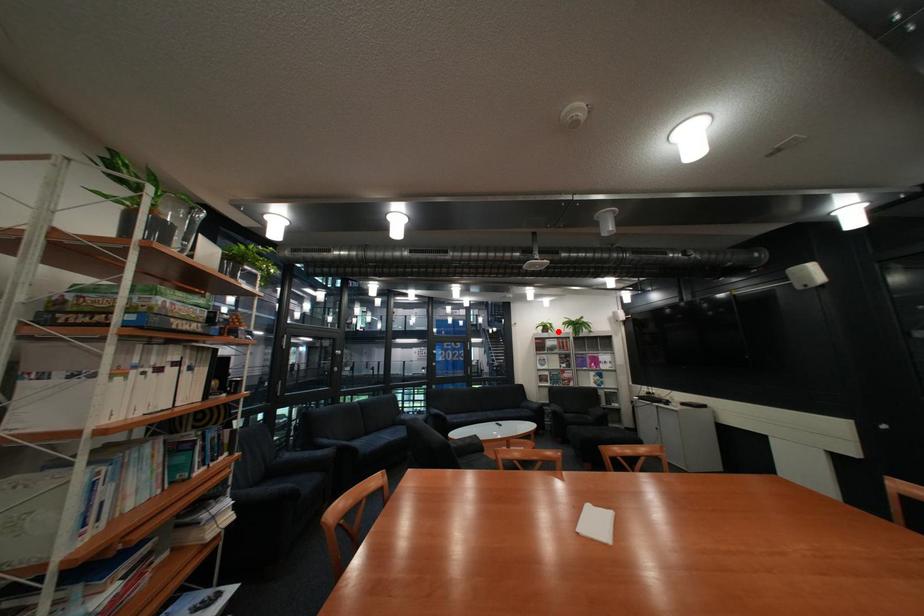
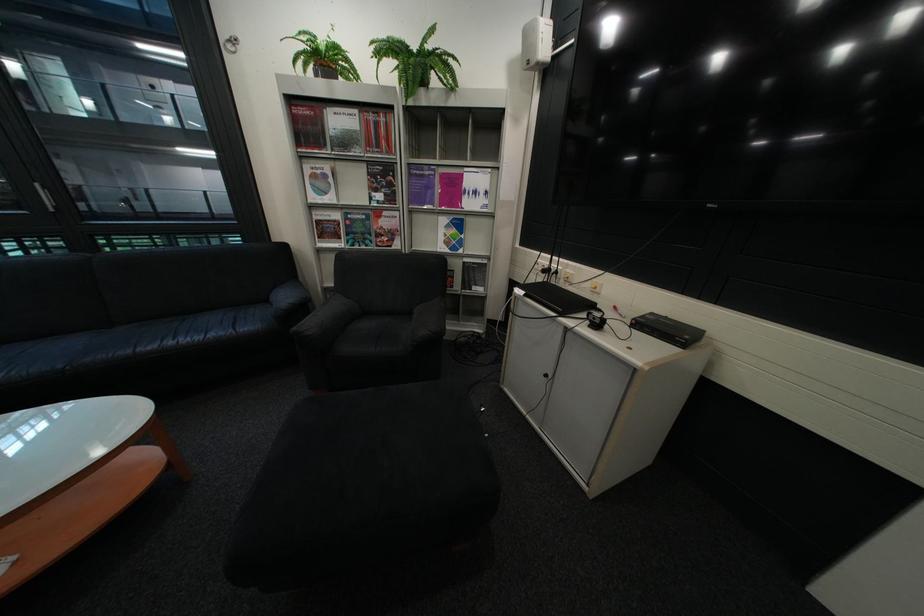
Find the pixel in the second image that matches the highlighted location in the first image.

(333, 78)